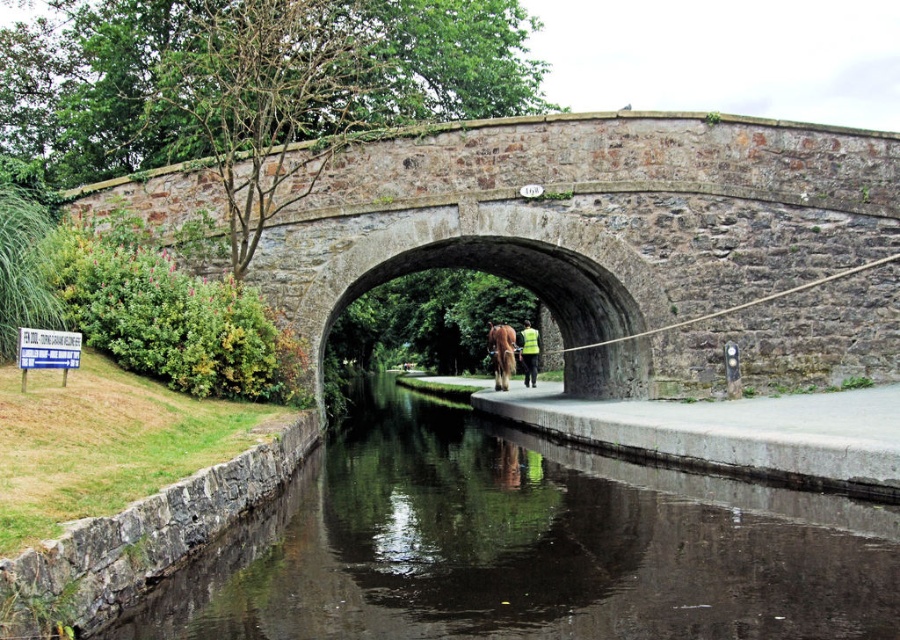
Question: Which point appears closest to the camera in this image?

Choices:
 (A) (723, 417)
 (B) (511, 356)
 (C) (724, 589)

Answer: (C)

Question: Among these points, which one is nearest to the camera?

Choices:
 (A) (524, 365)
 (B) (531, 273)

Answer: (B)

Question: Is rustic stone bridge at center bigger than stone archway at center?

Choices:
 (A) no
 (B) yes

Answer: (A)

Question: Based on their relative distances, which object is nearer to the brown fuzzy horse at center?

Choices:
 (A) smooth concrete path at center
 (B) dark reflective water at center

Answer: (A)

Question: Does dark reflective water at center appear over smooth concrete path at center?

Choices:
 (A) yes
 (B) no

Answer: (B)

Question: Does stone archway at center have a greater width compared to smooth concrete path at center?

Choices:
 (A) yes
 (B) no

Answer: (A)